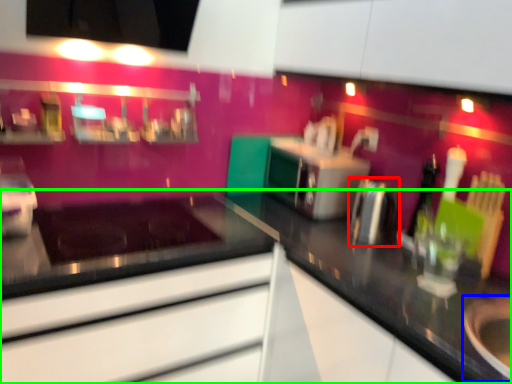
Question: Which object is positioned closest to appliance (highlighted by a red box)? Select from appliance (highlighted by a blue box) and countertop (highlighted by a green box).

Choices:
 (A) appliance
 (B) countertop

Answer: (B)